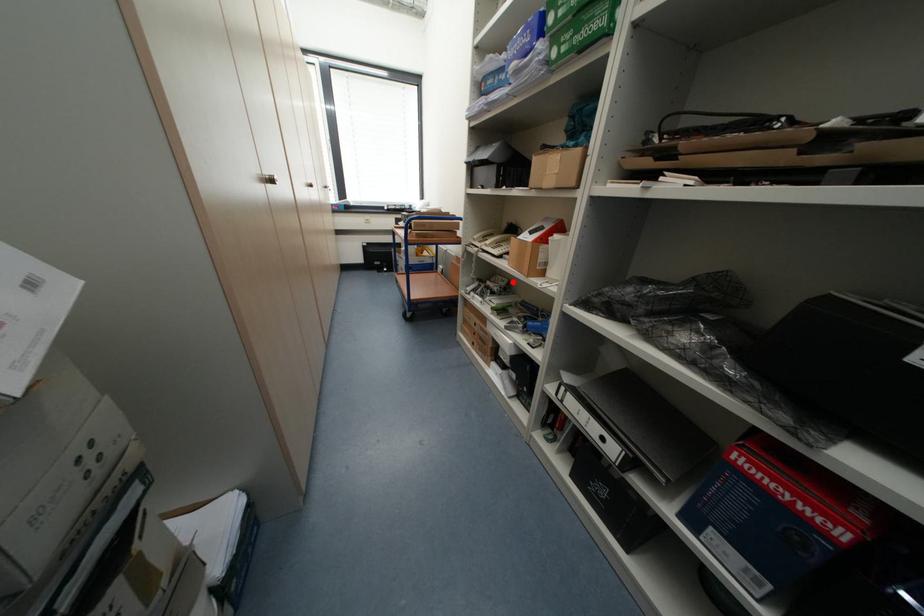
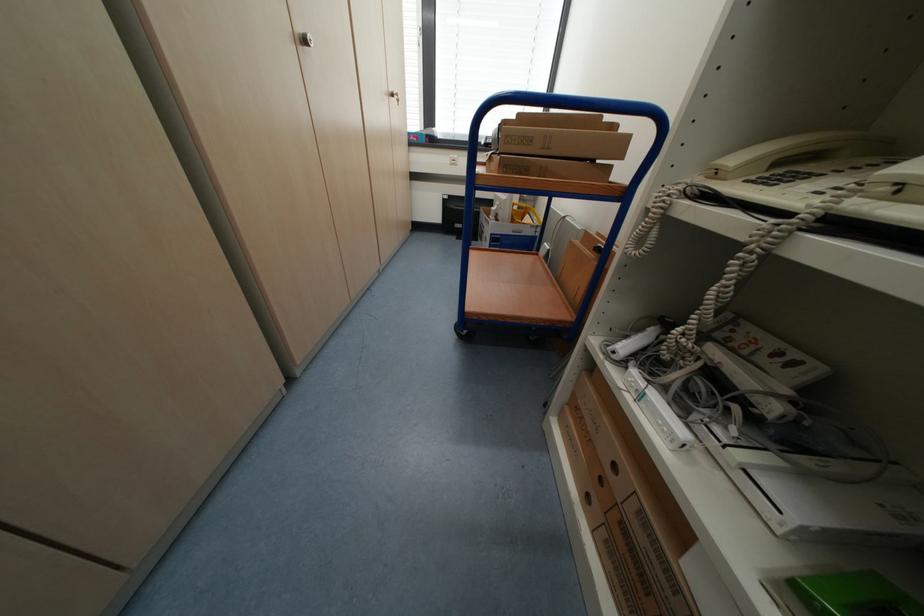
Locate, in the second image, the point that corresponds to the highlighted location in the first image.

(823, 370)